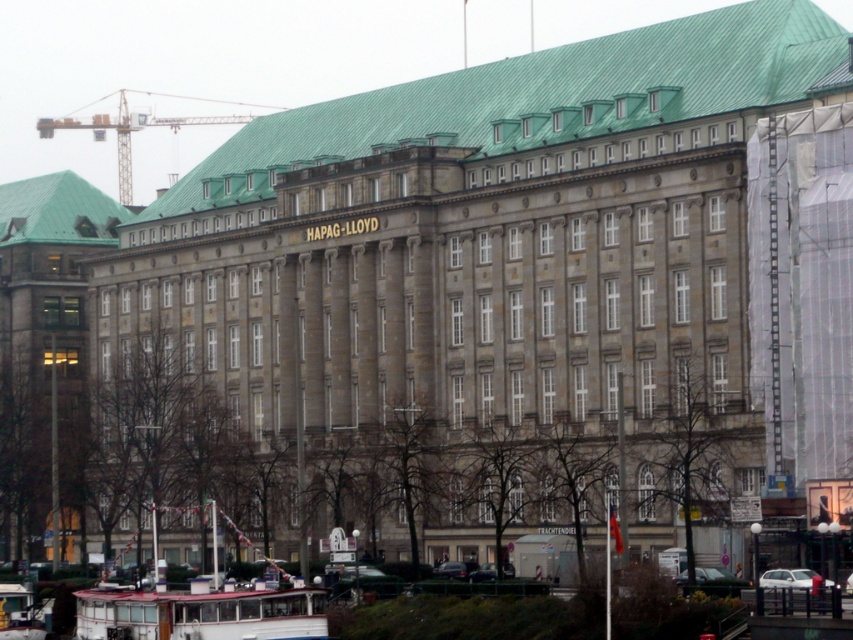
Which is above, white plastic boat at lower left or metallic yellow crane at upper left?

metallic yellow crane at upper left

Which is below, white plastic boat at lower left or metallic yellow crane at upper left?

white plastic boat at lower left

Is point (114, 618) positioned in front of point (160, 124)?

Yes, point (114, 618) is in front of point (160, 124).

The image size is (853, 640). What are the coordinates of `white plastic boat at lower left` in the screenshot? It's located at (202, 611).